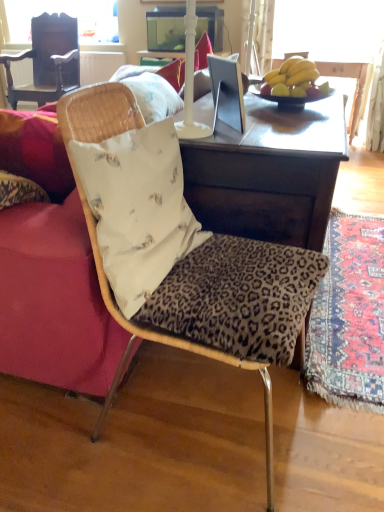
The width and height of the screenshot is (384, 512). Identify the location of free location above carpet with intricate patterns at lower right (from a real-world perspective). (346, 270).